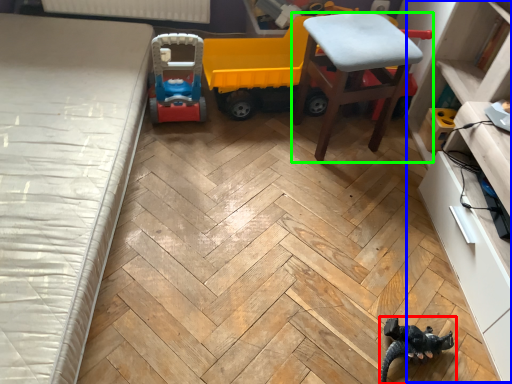
Question: Considering the real-world distances, which object is farthest from toy (highlighted by a red box)? dresser (highlighted by a blue box) or chair (highlighted by a green box)?

Choices:
 (A) dresser
 (B) chair

Answer: (B)